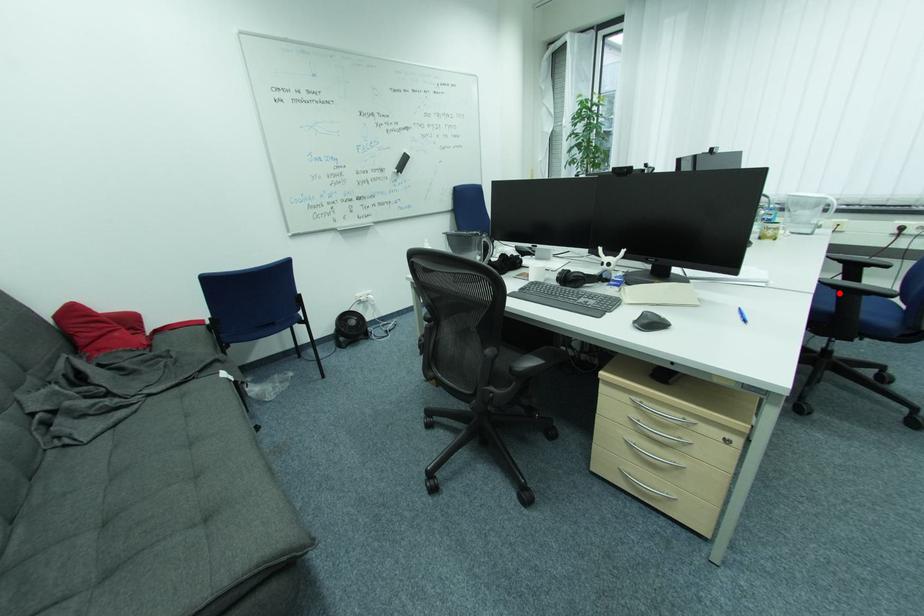
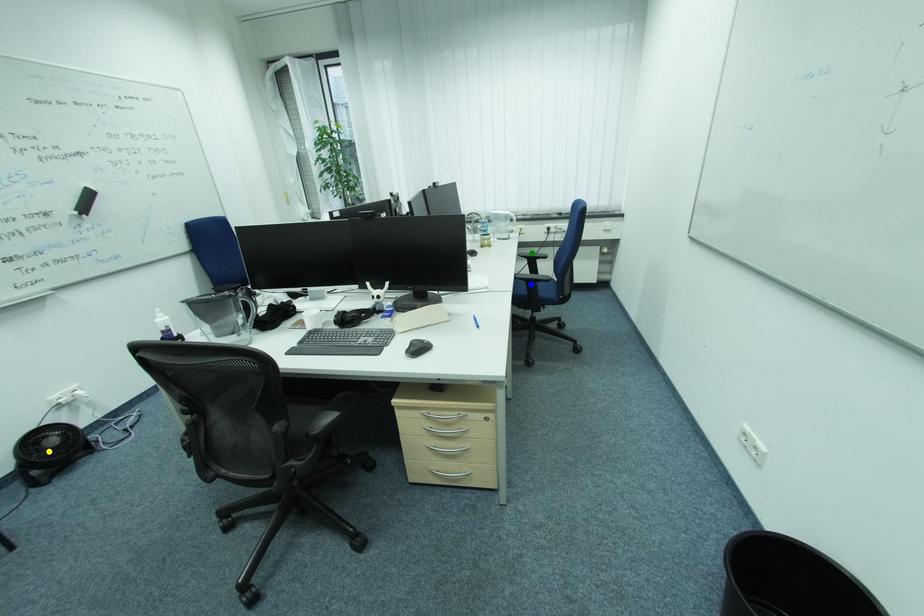
Question: I am providing you with two images of the same scene from different viewpoints. A red point is marked on the first image. You are given multiple points on the second image. Which mark in image 2 goes with the point in image 1?

Choices:
 (A) blue point
 (B) yellow point
 (C) green point

Answer: (A)